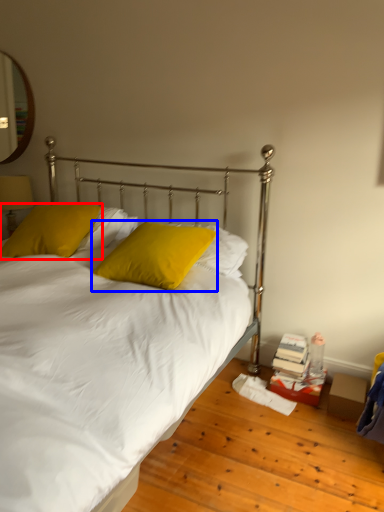
Question: Which object appears closest to the camera in this image, pillow (highlighted by a red box) or pillow (highlighted by a blue box)?

Choices:
 (A) pillow
 (B) pillow

Answer: (B)